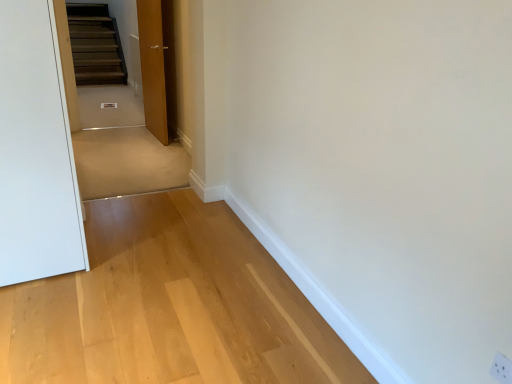
In order to face white plastic outlet at lower right, should I rotate leftwards or rightwards?

It's best to rotate right around 31.396 degrees.

Measure the distance between white plastic outlet at lower right and camera.

The distance of white plastic outlet at lower right from camera is 1.21 meters.

What do you see at coordinates (502, 368) in the screenshot? The image size is (512, 384). I see `white plastic outlet at lower right` at bounding box center [502, 368].

Find the location of a particular element. This screenshot has height=384, width=512. white plastic outlet at lower right is located at coordinates (502, 368).

The image size is (512, 384). Describe the element at coordinates (153, 68) in the screenshot. I see `matte wood door at center` at that location.

Locate an element on the screen. matte wood door at center is located at coordinates (153, 68).

Find the location of `white plastic outlet at lower right`. white plastic outlet at lower right is located at coordinates (502, 368).

Which is more to the right, white plastic outlet at lower right or matte wood door at center?

white plastic outlet at lower right is more to the right.

Which object is closer to the camera taking this photo, white plastic outlet at lower right or matte wood door at center?

Positioned in front is white plastic outlet at lower right.

Is point (497, 362) positioned in front of point (149, 48)?

Yes.

Consider the image. From the image's perspective, is white plastic outlet at lower right above matte wood door at center?

Incorrect, from the image's perspective, white plastic outlet at lower right is lower than matte wood door at center.

From a real-world perspective, between white plastic outlet at lower right and matte wood door at center, who is vertically lower?

white plastic outlet at lower right.

Which object is thinner, white plastic outlet at lower right or matte wood door at center?

Thinner between the two is white plastic outlet at lower right.

In terms of height, does white plastic outlet at lower right look taller or shorter compared to matte wood door at center?

Clearly, white plastic outlet at lower right is shorter compared to matte wood door at center.

Between white plastic outlet at lower right and matte wood door at center, which one has larger size?

matte wood door at center.

Would you say white plastic outlet at lower right contains matte wood door at center?

No, matte wood door at center is not surrounded by white plastic outlet at lower right.

Would you say white plastic outlet at lower right is a long distance from matte wood door at center?

Yes, white plastic outlet at lower right and matte wood door at center are located far from each other.

Does white plastic outlet at lower right turn towards matte wood door at center?

No, white plastic outlet at lower right is not oriented towards matte wood door at center.

This screenshot has height=384, width=512. I want to click on electric outlet below the matte wood door at center (from a real-world perspective), so click(x=502, y=368).

Which is more to the left, matte wood door at center or white plastic outlet at lower right?

Positioned to the left is matte wood door at center.

Is the position of matte wood door at center less distant than that of white plastic outlet at lower right?

No, it is behind white plastic outlet at lower right.

Does point (163, 123) lie behind point (498, 379)?

Yes, it is.

From the image's perspective, between matte wood door at center and white plastic outlet at lower right, which one is located above?

matte wood door at center appears higher in the image.

From a real-world perspective, is matte wood door at center located beneath white plastic outlet at lower right?

No, from a real-world perspective, matte wood door at center is not under white plastic outlet at lower right.

Considering the sizes of objects matte wood door at center and white plastic outlet at lower right in the image provided, who is thinner, matte wood door at center or white plastic outlet at lower right?

white plastic outlet at lower right is thinner.

Considering the sizes of objects matte wood door at center and white plastic outlet at lower right in the image provided, who is taller, matte wood door at center or white plastic outlet at lower right?

matte wood door at center is taller.

Who is smaller, matte wood door at center or white plastic outlet at lower right?

Smaller between the two is white plastic outlet at lower right.

Consider the image. Can white plastic outlet at lower right be found inside matte wood door at center?

Definitely not — white plastic outlet at lower right is not inside matte wood door at center.

Is the surface of matte wood door at center in direct contact with white plastic outlet at lower right?

matte wood door at center and white plastic outlet at lower right are not in contact.

Is matte wood door at center oriented towards white plastic outlet at lower right?

No, matte wood door at center is not oriented towards white plastic outlet at lower right.

Can you tell me how much matte wood door at center and white plastic outlet at lower right differ in facing direction?

The angle between the facing direction of matte wood door at center and the facing direction of white plastic outlet at lower right is 4.89 degrees.

Identify the location of door behind the white plastic outlet at lower right. This screenshot has width=512, height=384. (153, 68).

The image size is (512, 384). In the image, there is a matte wood door at center. Find the location of `electric outlet below it (from the image's perspective)`. electric outlet below it (from the image's perspective) is located at coordinates (502, 368).

This screenshot has height=384, width=512. Identify the location of door that is behind the white plastic outlet at lower right. (153, 68).